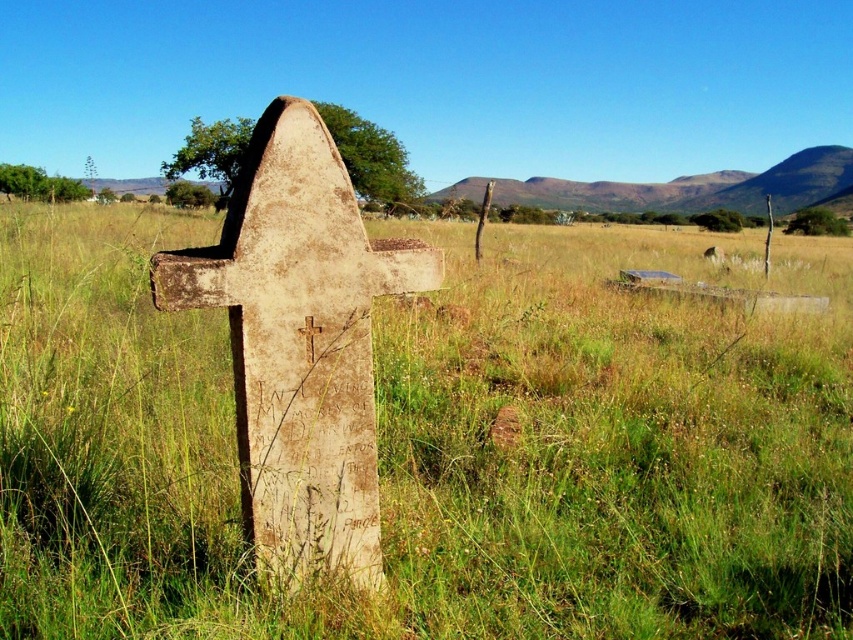
Question: Among these objects, which one is farthest from the camera?

Choices:
 (A) weathered stone cross at center
 (B) golden textured cross at center

Answer: (B)

Question: Does weathered stone cross at center appear on the left side of golden textured cross at center?

Choices:
 (A) no
 (B) yes

Answer: (B)

Question: Does weathered stone cross at center come behind golden textured cross at center?

Choices:
 (A) yes
 (B) no

Answer: (B)

Question: Which point is farther to the camera?

Choices:
 (A) golden textured cross at center
 (B) weathered stone cross at center

Answer: (A)

Question: Can you confirm if weathered stone cross at center is wider than golden textured cross at center?

Choices:
 (A) no
 (B) yes

Answer: (B)